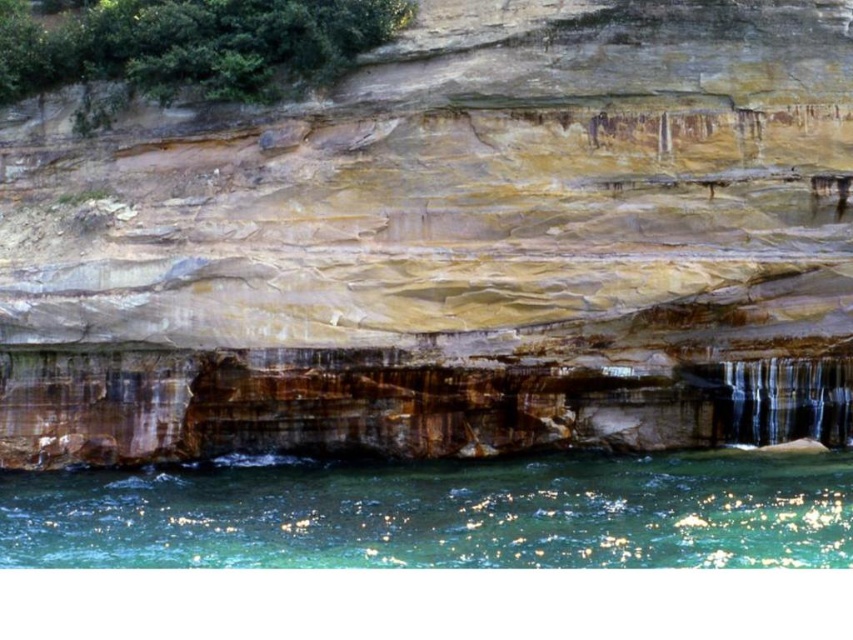
You are standing on a cliff overlooking the clear glass water at lower center and the clear glass waterfall at lower right. Which object is positioned farther to the east?

The clear glass waterfall at lower right is farther to the east because it is to the right of the clear glass water at lower center.

You are standing at the cliff edge and want to cross from the clear glass water at lower center to the clear glass waterfall at lower right. The distance between them is crucial for your jump. Can you make the jump if your maximum jump distance is 14 meters?

The clear glass water at lower center is 14.51 meters away from the clear glass waterfall at lower right. Since your maximum jump distance is 14 meters, you cannot make the jump as the distance is slightly longer than your capability.

Based on the photo, you are an explorer assessing the terrain. You need to cross from one side of the clear glass water at lower center to the other. The rustic stone cliff at center is in your path. Can you walk around the cliff to reach the other side?

The rustic stone cliff at center is wider than the clear glass water at lower center, so you can walk around the cliff to reach the other side since the cliff is not as wide as the water body.